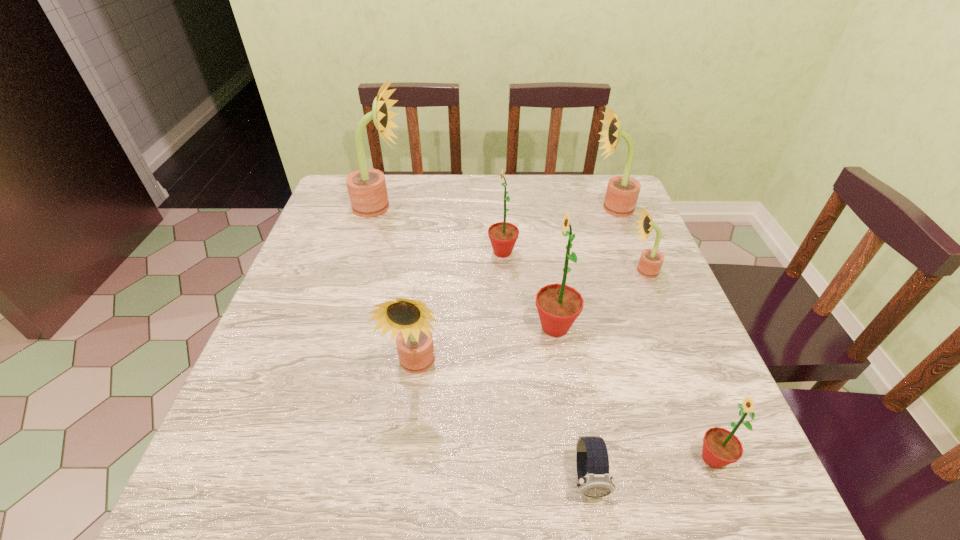
Find the location of a particular element. the leftmost yellow sunflower is located at coordinates click(x=367, y=189).

This screenshot has width=960, height=540. Find the location of `the tallest object`. the tallest object is located at coordinates (367, 189).

Identify the location of the third smallest yellow sunflower. (622, 192).

At what (x,y) coordinates should I click in order to perform the action: click on the biggest green sunflower. Please return your answer as a coordinate pair (x, y). Looking at the image, I should click on tap(558, 305).

The height and width of the screenshot is (540, 960). Identify the location of the second nearest green sunflower. (558, 305).

Locate an element on the screen. The height and width of the screenshot is (540, 960). the second biggest green sunflower is located at coordinates (503, 235).

In order to click on the farthest green sunflower in this screenshot , I will do point(503,235).

Identify the location of the nearest yellow sunflower. (407, 319).

In order to click on the second object from left to right in this screenshot , I will do `click(407, 319)`.

The height and width of the screenshot is (540, 960). Identify the location of the smallest yellow sunflower. (651, 260).